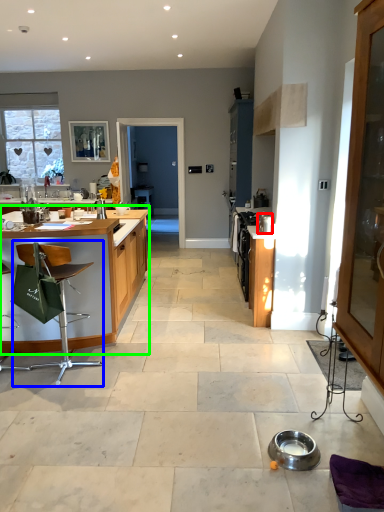
Question: Considering the real-world distances, which object is farthest from appliance (highlighted by a red box)? chair (highlighted by a blue box) or table (highlighted by a green box)?

Choices:
 (A) chair
 (B) table

Answer: (A)